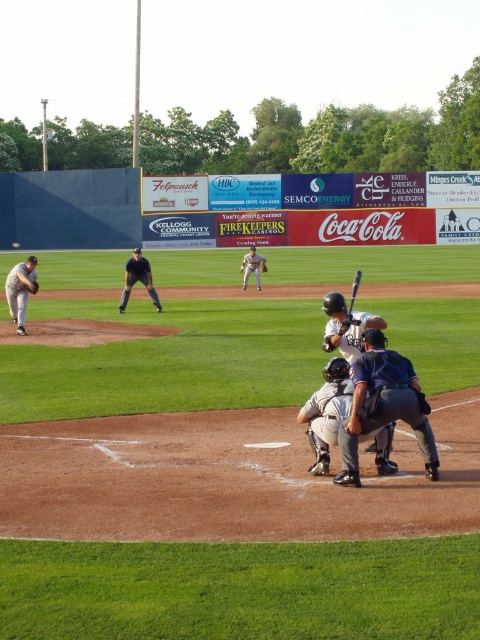
Question: Considering the real-world distances, which object is farthest from the gray matte uniform at center?

Choices:
 (A) black matte bat at center
 (B) dark blue uniform at center

Answer: (A)

Question: Can you confirm if dark blue uniform at center is smaller than gray uniformed player at center?

Choices:
 (A) yes
 (B) no

Answer: (A)

Question: Which of these objects is positioned farthest from the gray matte uniform at center?

Choices:
 (A) dark blue uniform at center
 (B) gray uniformed player at center

Answer: (B)

Question: Is the position of gray uniformed player at center more distant than that of brown leather glove at center?

Choices:
 (A) yes
 (B) no

Answer: (B)

Question: Is gray uniformed player at center thinner than brown leather glove at pitcher?

Choices:
 (A) yes
 (B) no

Answer: (B)

Question: Which object is closer to the camera taking this photo?

Choices:
 (A) gray uniformed player at center
 (B) black uniform at center
 (C) gray matte uniform at center
 (D) gray matte uniform at left

Answer: (C)